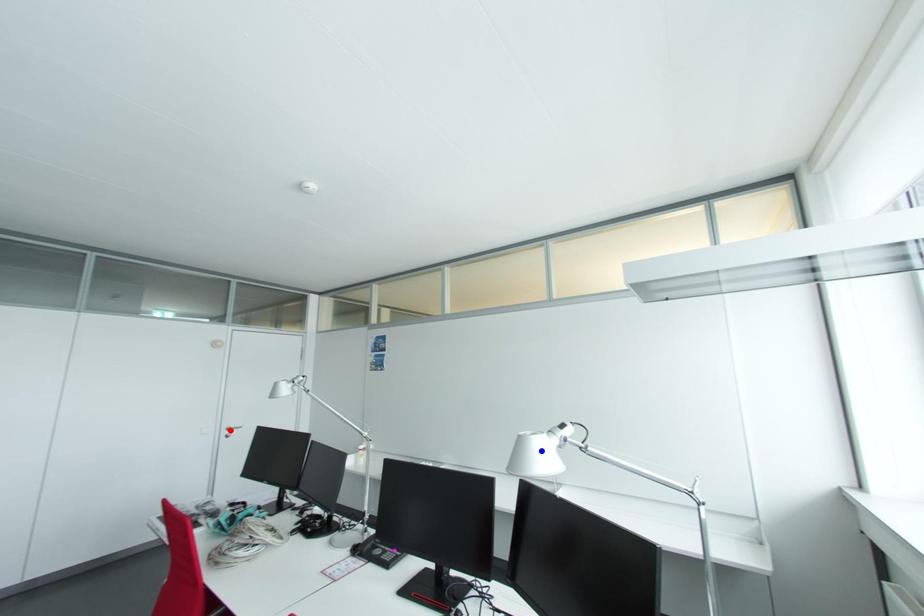
Question: Which of the two points in the image is closer to the camera?

Choices:
 (A) Blue point is closer.
 (B) Red point is closer.

Answer: (A)